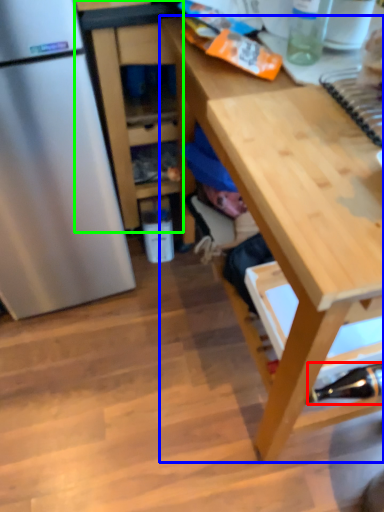
Question: Which object is positioned farthest from bottle (highlighted by a red box)? Select from desk (highlighted by a blue box) and cabinetry (highlighted by a green box).

Choices:
 (A) desk
 (B) cabinetry

Answer: (B)